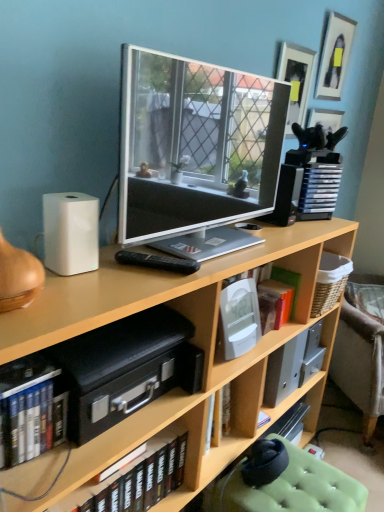
Question: From the image's perspective, relative to white plastic speaker at right, which is the second speaker in bottom-to-top order, is hardcover books at lower left, marked as the 1th book in a front-to-back arrangement, above or below?

Choices:
 (A) below
 (B) above

Answer: (A)

Question: Based on their sizes in the image, would you say hardcover books at lower left, which is counted as the 3th book, starting from the right, is bigger or smaller than white plastic speaker at right, marked as the first speaker in a right-to-left arrangement?

Choices:
 (A) small
 (B) big

Answer: (B)

Question: Which of these objects is positioned closest to the green fabric swivel chair at lower right?

Choices:
 (A) hardcover books at lower left, acting as the second book starting from the top
 (B) orange matte book at center-right, which is the 3th book in front-to-back order
 (C) white plastic speaker at right, marked as the first speaker in a right-to-left arrangement
 (D) matte silver tv at center
 (E) black plastic remote at center

Answer: (B)

Question: Which of these objects is positioned closest to the matte silver tv at center?

Choices:
 (A) orange matte book at center-right, the 1th book from the back
 (B) woven basket at lower right
 (C) white plastic speaker at right, which appears as the 1th speaker when viewed from the back
 (D) black plastic remote at center
 (E) matte black picture frame at upper right, the first picture frame from the left

Answer: (D)